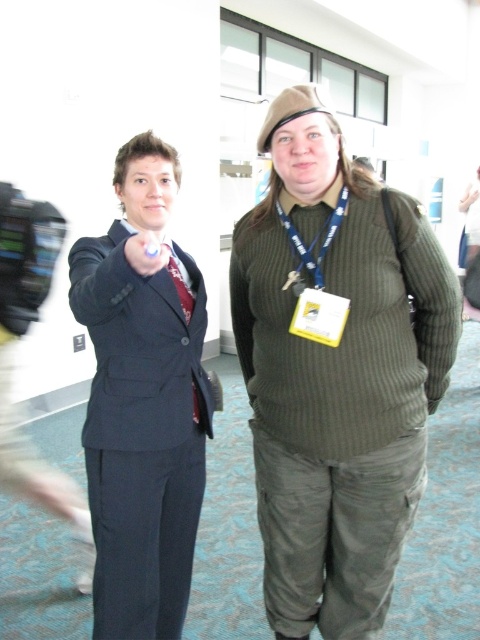
You are a photographer trying to capture a photo of the matte black suit at center and the green fabric neck at center. Which object is located lower in the frame?

The matte black suit at center is positioned under the green fabric neck at center, so it is located lower in the frame.

You are standing in the hallway and see the point marked at coordinates (143, 401). Which object does this point indicate?

The point at coordinates (143, 401) indicates the matte black suit at center.